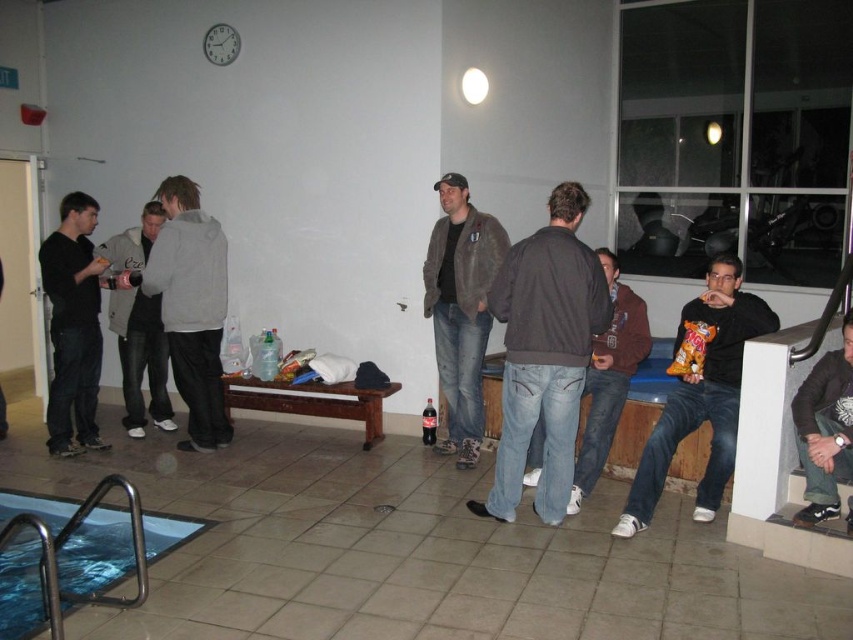
Question: Considering the real-world distances, which object is closest to the gray hoodie at center?

Choices:
 (A) matte black hoodie at left
 (B) dark red plastic bottle at center
 (C) dark gray hoodie at lower right
 (D) matte black jacket at right

Answer: (A)

Question: Which point appears closest to the camera in this image?

Choices:
 (A) (94, 387)
 (B) (512, 436)
 (C) (602, 378)

Answer: (B)

Question: Does gray hoodie at center appear under matte black hoodie at left?

Choices:
 (A) no
 (B) yes

Answer: (A)

Question: Which point is closer to the camera?

Choices:
 (A) gray hoodie at center
 (B) brown leather jacket at center
 (C) dark brown leather jacket at center

Answer: (C)

Question: Is gray hoodie at center closer to camera compared to dark red plastic bottle at center?

Choices:
 (A) no
 (B) yes

Answer: (B)

Question: In this image, where is gray hoodie at center located relative to matte black hoodie at left?

Choices:
 (A) right
 (B) left

Answer: (A)